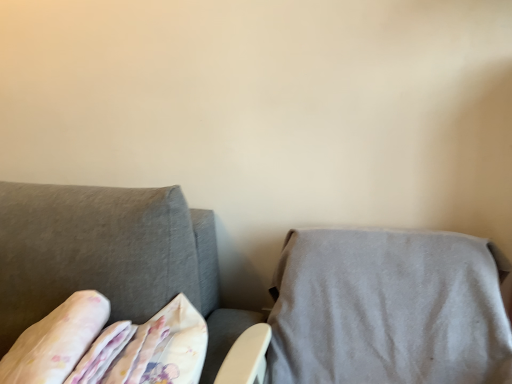
In order to face gray fabric pillow at center, should I rotate leftwards or rightwards?

Turn right by 17.615 degrees to look at gray fabric pillow at center.

Identify the location of gray fabric pillow at center. This screenshot has height=384, width=512. (387, 309).

The image size is (512, 384). What do you see at coordinates (387, 309) in the screenshot? I see `gray fabric pillow at center` at bounding box center [387, 309].

Locate an element on the screen. The width and height of the screenshot is (512, 384). gray fabric pillow at center is located at coordinates (387, 309).